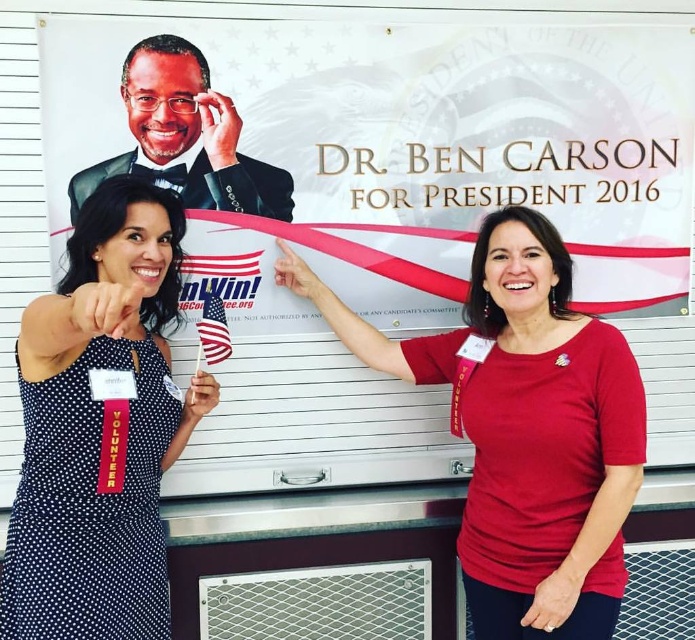
Does matte black suit at upper left appear under american flag at center?

No, matte black suit at upper left is not below american flag at center.

Can you confirm if matte black suit at upper left is thinner than american flag at center?

No.

This screenshot has width=695, height=640. I want to click on matte black suit at upper left, so click(x=186, y=136).

Can you confirm if white paperboard at upper center is wider than matte black suit at upper left?

Correct, the width of white paperboard at upper center exceeds that of matte black suit at upper left.

This screenshot has height=640, width=695. Identify the location of white paperboard at upper center. (375, 193).

Is point (373, 81) positioned behind point (158, 128)?

Yes.

I want to click on white paperboard at upper center, so click(375, 193).

From the picture: Is red matte shirt at center to the right of matte black suit at upper left from the viewer's perspective?

Yes, red matte shirt at center is to the right of matte black suit at upper left.

This screenshot has height=640, width=695. Find the location of `red matte shirt at center`. red matte shirt at center is located at coordinates (525, 429).

Find the location of `red matte shirt at center`. red matte shirt at center is located at coordinates (525, 429).